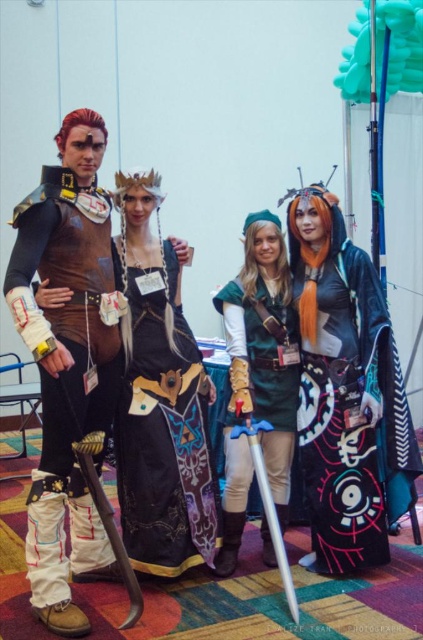
Question: Which object is the closest to the green leather armor at center?

Choices:
 (A) silver metallic sword at center
 (B) velvet black cape at center
 (C) brown leather vest at left
 (D) black satin dress at center

Answer: (B)

Question: Does green leather armor at center have a larger size compared to silver metallic sword at center?

Choices:
 (A) no
 (B) yes

Answer: (B)

Question: Considering the relative positions of brown leather vest at left and gold metallic sword at lower left in the image provided, where is brown leather vest at left located with respect to gold metallic sword at lower left?

Choices:
 (A) above
 (B) below

Answer: (A)

Question: Among these points, which one is farthest from the camera?

Choices:
 (A) (76, 557)
 (B) (211, 563)
 (C) (373, 424)

Answer: (C)

Question: Where is brown leather vest at left located in relation to green leather armor at center in the image?

Choices:
 (A) above
 (B) below

Answer: (A)

Question: Among these points, which one is farthest from the camera?

Choices:
 (A) (161, 449)
 (B) (359, 374)
 (C) (40, 566)

Answer: (B)